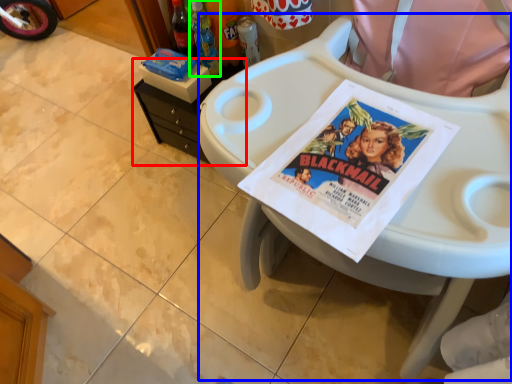
Question: Which is nearer to the changing table (highlighted by a red box)? feeding chair (highlighted by a blue box) or bottle (highlighted by a green box).

Choices:
 (A) feeding chair
 (B) bottle

Answer: (B)